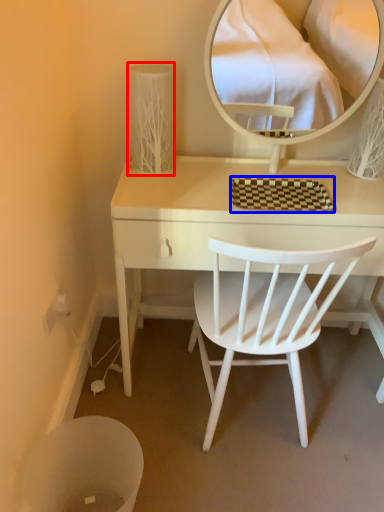
Question: Among these objects, which one is farthest to the camera, table lamp (highlighted by a red box) or mat (highlighted by a blue box)?

Choices:
 (A) table lamp
 (B) mat

Answer: (A)